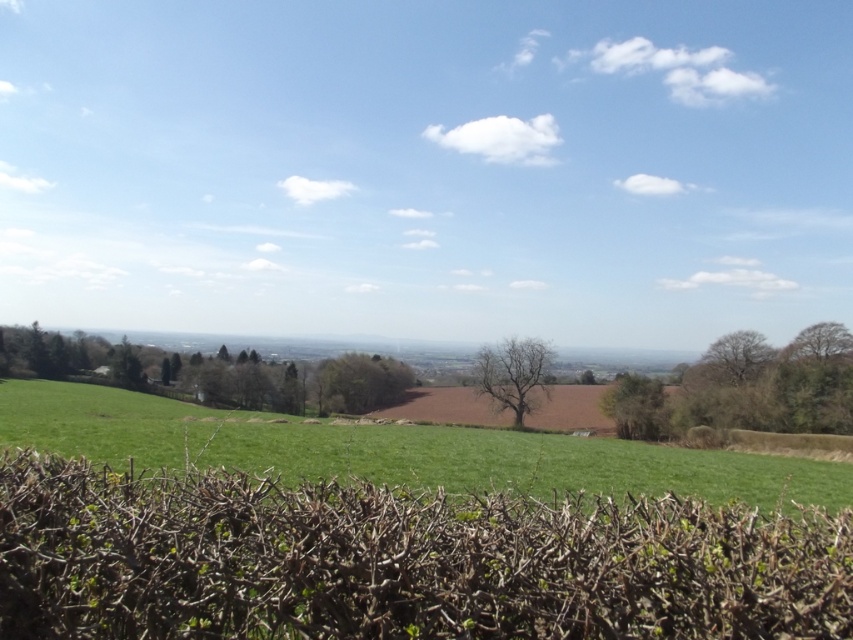
Question: Does green grassy field at center have a lesser width compared to bare branches at upper right?

Choices:
 (A) yes
 (B) no

Answer: (B)

Question: Is brown dry hedge at lower center behind green leafy tree at center-right?

Choices:
 (A) yes
 (B) no

Answer: (B)

Question: Based on their relative distances, which object is farther from the bare branches at upper right?

Choices:
 (A) green leafy tree at center
 (B) brown textured tree at right
 (C) brown dry hedge at lower center

Answer: (C)

Question: Which point is farther to the camera?

Choices:
 (A) (727, 381)
 (B) (321, 396)

Answer: (B)

Question: In this image, where is bare branches at center located relative to brown textured tree at right?

Choices:
 (A) left
 (B) right

Answer: (A)

Question: Which object is farther from the camera taking this photo?

Choices:
 (A) green leafy tree at center-right
 (B) bare branches at upper right
 (C) brown textured tree at right
 (D) bare branches at center

Answer: (C)